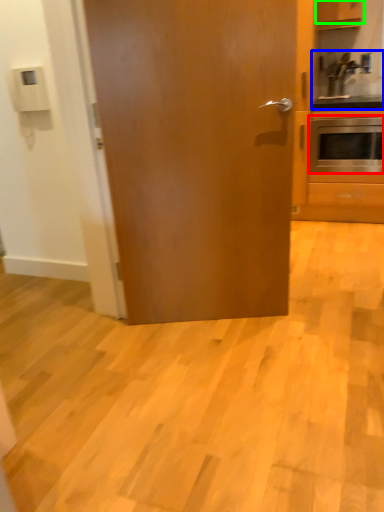
Question: Which object is the closest to the oven (highlighted by a red box)? Choose among these: sink (highlighted by a blue box) or cabinetry (highlighted by a green box).

Choices:
 (A) sink
 (B) cabinetry

Answer: (A)